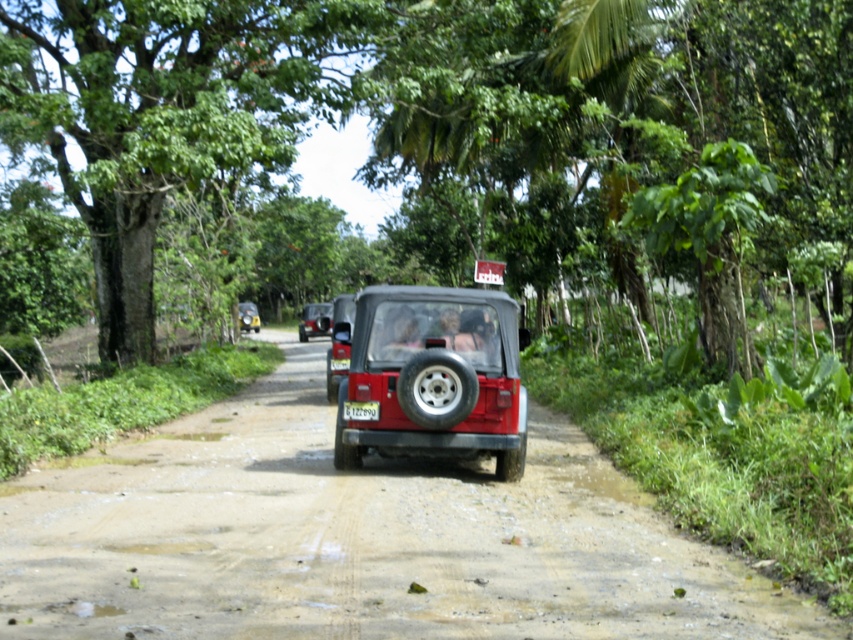
Question: Among these objects, which one is nearest to the camera?

Choices:
 (A) dirt track at center
 (B) matte red jeep at center
 (C) metallic silver car at center

Answer: (A)

Question: Which is farther from the dirt track at center?

Choices:
 (A) matte red jeep at center
 (B) white plastic license plate at center
 (C) metallic silver car at center

Answer: (C)

Question: Which point is closer to the camera?

Choices:
 (A) (366, 419)
 (B) (498, 436)

Answer: (B)

Question: Does dirt track at center appear under matte red jeep at center?

Choices:
 (A) yes
 (B) no

Answer: (A)

Question: Does white plastic license plate at center appear on the right side of metallic silver car at center?

Choices:
 (A) yes
 (B) no

Answer: (A)

Question: Is green leafy tree at center bigger than dirt track at center?

Choices:
 (A) yes
 (B) no

Answer: (A)